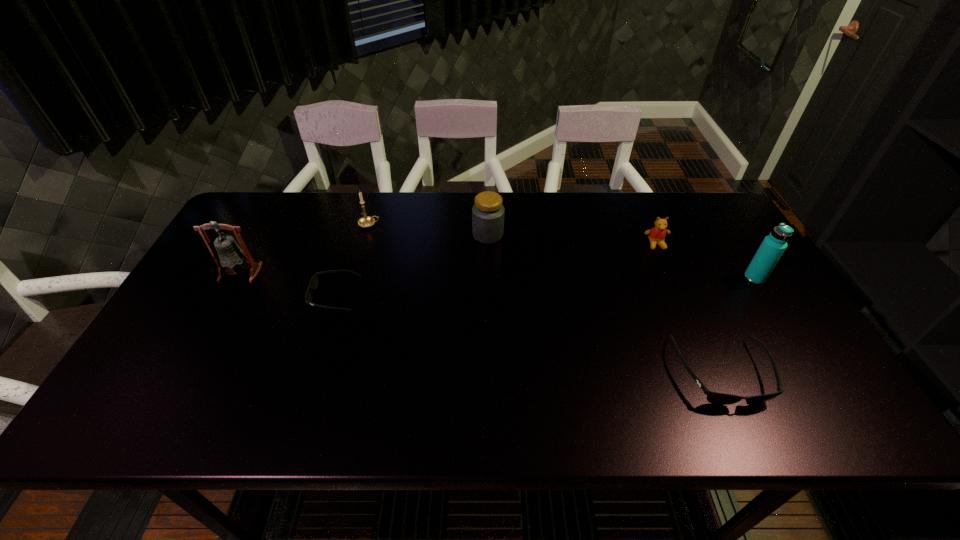
The image size is (960, 540). Find the location of `vacant space located on the front-facing side of the shortest object`. vacant space located on the front-facing side of the shortest object is located at coordinates (289, 295).

This screenshot has width=960, height=540. I want to click on free spot located 0.100m on the front-facing side of the shortest object, so click(x=274, y=295).

Find the location of a particular element. This screenshot has width=960, height=540. free point located on the front-facing side of the teddy bear is located at coordinates (670, 277).

At what (x,y) coordinates should I click in order to perform the action: click on free region located on the handle side of the candle holder. Please return your answer as a coordinate pair (x, y). The image size is (960, 540). Looking at the image, I should click on (437, 224).

What are the coordinates of `free space located on the surface of the fourth object from left to right near the warning symbol` in the screenshot? It's located at (402, 235).

This screenshot has width=960, height=540. Identify the location of vacant space located 0.320m on the surface of the fourth object from left to right near the warning symbol. (370, 235).

Locate an element on the screen. free location located on the surface of the fourth object from left to right near the warning symbol is located at coordinates (367, 235).

Identify the location of blank space located 0.100m on the back of the water bottle. This screenshot has height=540, width=960. (736, 248).

Identify the location of free space located 0.210m on the front of the bell. (202, 345).

This screenshot has width=960, height=540. In order to click on candle holder located at the far edge in this screenshot , I will do `click(366, 221)`.